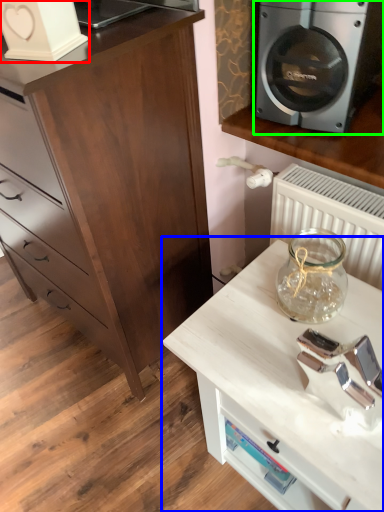
Question: Which object is the closest to the appliance (highlighted by a red box)? Choose among these: table (highlighted by a blue box) or home appliance (highlighted by a green box).

Choices:
 (A) table
 (B) home appliance

Answer: (B)